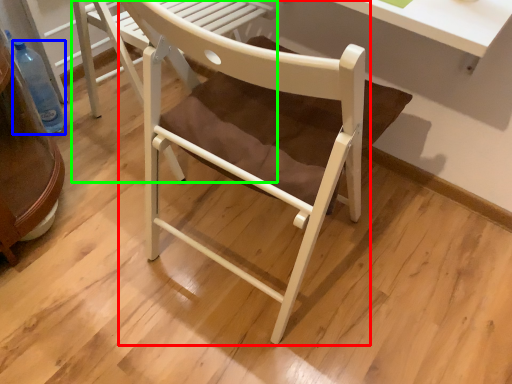
Question: Considering the real-world distances, which object is farthest from chair (highlighted by a red box)? bottle (highlighted by a blue box) or chair (highlighted by a green box)?

Choices:
 (A) bottle
 (B) chair

Answer: (A)